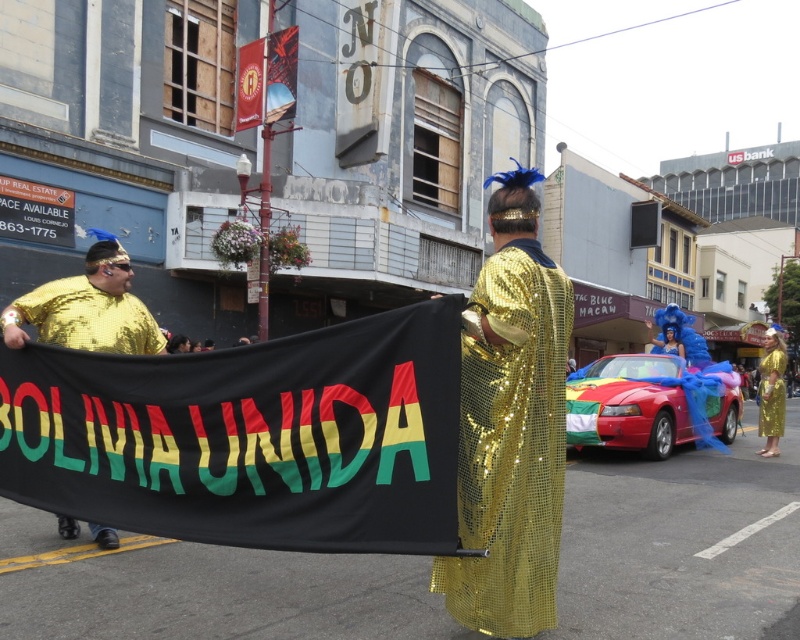
Question: Which object is farther from the camera taking this photo?

Choices:
 (A) black fabric banner at center
 (B) gold sequined shirt at left
 (C) gold sequined dress at center
 (D) gold sequined cape at center

Answer: (C)

Question: Does gold sequined shirt at left appear under gold sequined dress at center?

Choices:
 (A) no
 (B) yes

Answer: (A)

Question: Which of the following is the closest to the observer?

Choices:
 (A) (112, 547)
 (B) (784, 397)
 (C) (320, 417)
 (D) (472, 593)

Answer: (C)

Question: Does black fabric banner at center appear on the right side of gold sequined dress at center?

Choices:
 (A) yes
 (B) no

Answer: (B)

Question: In this image, where is black fabric banner at center located relative to gold sequined shirt at left?

Choices:
 (A) above
 (B) below

Answer: (B)

Question: Considering the real-world distances, which object is farthest from the gold sequined cape at center?

Choices:
 (A) black fabric banner at center
 (B) gold sequined shirt at left

Answer: (B)